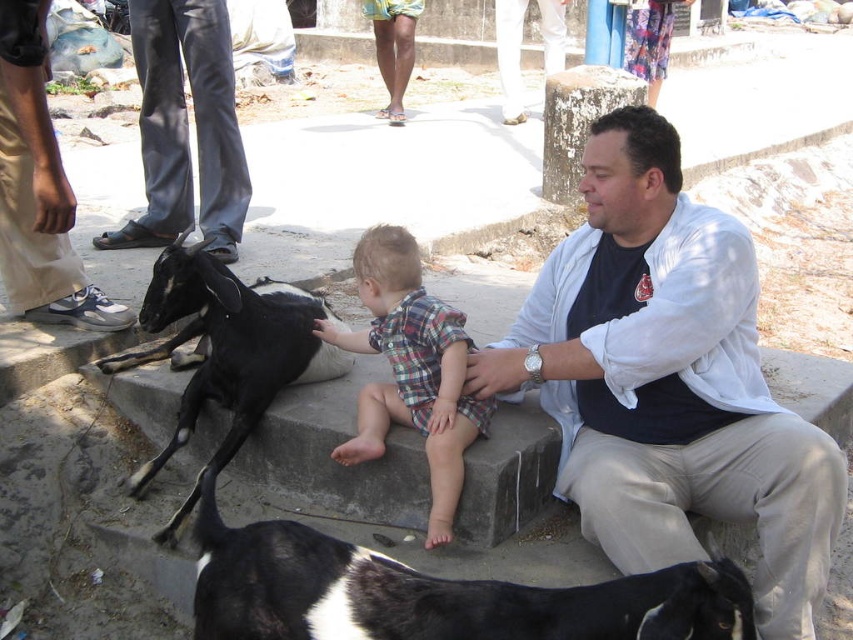
Is point (531, 618) closer to camera compared to point (38, 4)?

Yes.

The height and width of the screenshot is (640, 853). What do you see at coordinates (434, 593) in the screenshot?
I see `black and white fur at lower center` at bounding box center [434, 593].

Consider the image. Measure the distance between black and white fur at lower center and camera.

black and white fur at lower center is 6.03 feet from camera.

Identify the location of black and white fur at lower center. (434, 593).

I want to click on black leather pants at left, so click(184, 125).

Does black leather pants at left appear on the left side of matte black goat at left?

Incorrect, black leather pants at left is not on the left side of matte black goat at left.

This screenshot has height=640, width=853. Identify the location of black leather pants at left. click(x=184, y=125).

The image size is (853, 640). What do you see at coordinates (668, 380) in the screenshot?
I see `matte white shirt at center` at bounding box center [668, 380].

Can you confirm if matte white shirt at center is thinner than black and white fur at lower center?

Correct, matte white shirt at center's width is less than black and white fur at lower center's.

Between point (724, 408) and point (415, 586), which one is positioned behind?

Point (724, 408)

The image size is (853, 640). In order to click on matte white shirt at center in this screenshot , I will do `click(668, 380)`.